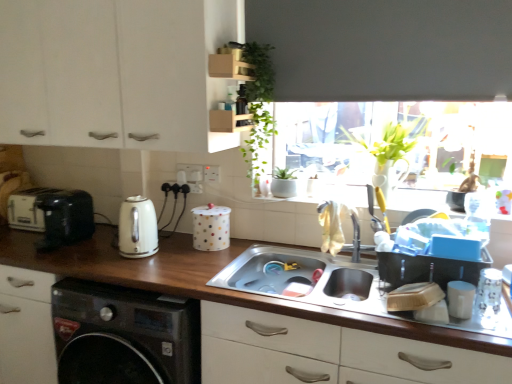
Question: Is wooden at lower center turned away from white matte cabinet at upper left?

Choices:
 (A) yes
 (B) no

Answer: (B)

Question: Can you confirm if wooden at lower center is positioned to the left of white matte cabinet at upper left?

Choices:
 (A) yes
 (B) no

Answer: (B)

Question: Does wooden at lower center have a lesser width compared to white matte cabinet at upper left?

Choices:
 (A) yes
 (B) no

Answer: (B)

Question: Considering the relative positions of wooden at lower center and white matte cabinet at upper left in the image provided, is wooden at lower center to the right of white matte cabinet at upper left from the viewer's perspective?

Choices:
 (A) yes
 (B) no

Answer: (A)

Question: From a real-world perspective, is wooden at lower center beneath white matte cabinet at upper left?

Choices:
 (A) no
 (B) yes

Answer: (B)

Question: Considering the positions of point (354, 244) and point (36, 243), is point (354, 244) closer or farther from the camera than point (36, 243)?

Choices:
 (A) closer
 (B) farther

Answer: (A)

Question: From a real-world perspective, is silver metallic faucet at sink center positioned above or below matte black toaster at left, positioned as the second appliance in left-to-right order?

Choices:
 (A) above
 (B) below

Answer: (A)

Question: From the image's perspective, is silver metallic faucet at sink center above or below matte black toaster at left, which is the second appliance in front-to-back order?

Choices:
 (A) below
 (B) above

Answer: (A)

Question: Relative to matte black toaster at left, the third appliance viewed from the right, is silver metallic faucet at sink center in front or behind?

Choices:
 (A) front
 (B) behind

Answer: (A)

Question: Considering the positions of white glossy kettle at left and green leafy plant at upper center in the image, is white glossy kettle at left wider or thinner than green leafy plant at upper center?

Choices:
 (A) thin
 (B) wide

Answer: (A)

Question: Considering their positions, is white glossy kettle at left located in front of or behind green leafy plant at upper center?

Choices:
 (A) front
 (B) behind

Answer: (B)

Question: From the image's perspective, is white glossy kettle at left positioned above or below green leafy plant at upper center?

Choices:
 (A) above
 (B) below

Answer: (B)

Question: Considering the positions of white glossy kettle at left and green leafy plant at upper center in the image, is white glossy kettle at left taller or shorter than green leafy plant at upper center?

Choices:
 (A) tall
 (B) short

Answer: (B)

Question: From the image's perspective, relative to matte black bottle at upper center, is green leafy plant at upper center above or below?

Choices:
 (A) below
 (B) above

Answer: (A)

Question: Looking at their shapes, would you say green leafy plant at upper center is wider or thinner than matte black bottle at upper center?

Choices:
 (A) thin
 (B) wide

Answer: (B)